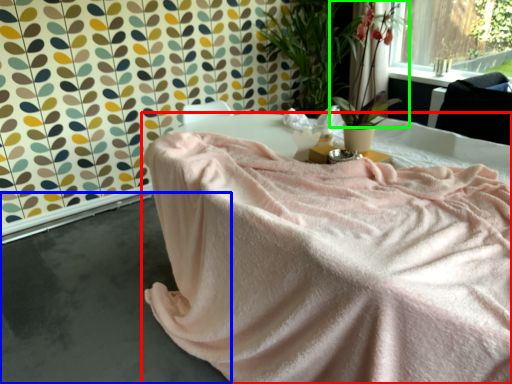
Question: Based on their relative distances, which object is farther from furniture (highlighted by a red box)? Choose from concrete (highlighted by a blue box) and floral arrangement (highlighted by a green box).

Choices:
 (A) concrete
 (B) floral arrangement

Answer: (B)